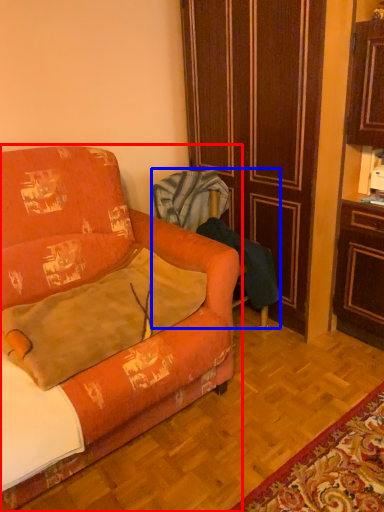
Question: Which of the following is the closest to the observer, studio couch (highlighted by a red box) or armchair (highlighted by a blue box)?

Choices:
 (A) studio couch
 (B) armchair

Answer: (A)